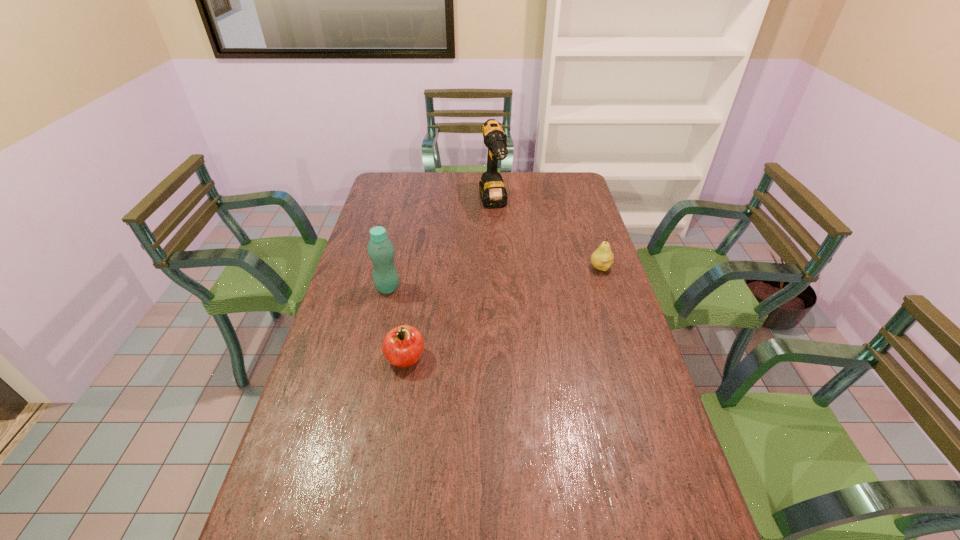
At what (x,y) coordinates should I click in order to perform the action: click on free region at the left edge of the desktop. Please return your answer as a coordinate pair (x, y). Looking at the image, I should click on click(x=360, y=303).

Where is `free spot at the right edge of the desktop`? This screenshot has height=540, width=960. free spot at the right edge of the desktop is located at coordinates (601, 280).

In order to click on vacant region at the far left corner in this screenshot , I will do `click(391, 176)`.

Locate an element on the screen. This screenshot has width=960, height=540. free space between the tallest object and the third nearest object is located at coordinates (547, 236).

Identify the location of free space between the third object from left to right and the second farthest object. (547, 236).

At what (x,y) coordinates should I click in order to perform the action: click on free spot between the second object from right to left and the nearest object. Please return your answer as a coordinate pair (x, y). This screenshot has width=960, height=540. Looking at the image, I should click on (449, 281).

Locate an element on the screen. The width and height of the screenshot is (960, 540). free space between the second farthest object and the farthest object is located at coordinates (547, 236).

At what (x,y) coordinates should I click in order to perform the action: click on blank region between the farthest object and the second tallest object. Please return your answer as a coordinate pair (x, y). The height and width of the screenshot is (540, 960). Looking at the image, I should click on (441, 246).

Image resolution: width=960 pixels, height=540 pixels. Identify the location of unoccupied area between the nearest object and the third farthest object. tap(396, 323).

You are a GUI agent. You are given a task and a screenshot of the screen. Output one action in this format:
    pyautogui.click(x=<x>, y=<y>)
    Task: Click on the unoccupied area between the tallest object and the water bottle
    This screenshot has height=540, width=960.
    Given the screenshot: What is the action you would take?
    pyautogui.click(x=441, y=246)